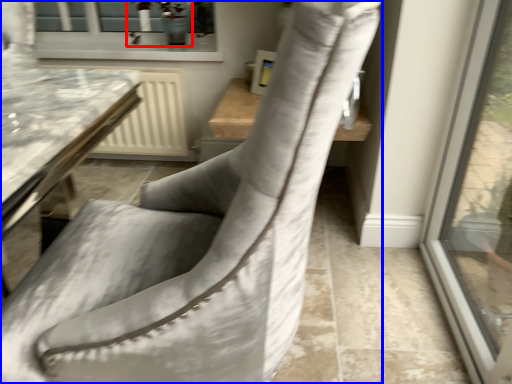
Question: Which object appears closest to the camera in this image, plant (highlighted by a red box) or chair (highlighted by a blue box)?

Choices:
 (A) plant
 (B) chair

Answer: (B)